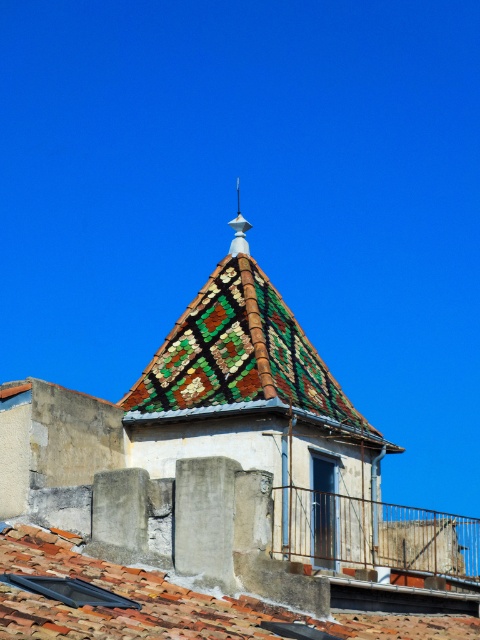
Question: Which object appears closest to the camera in this image?

Choices:
 (A) white glossy spire at upper center
 (B) terracotta clay tiles at lower left
 (C) mosaic tile roof at center

Answer: (B)

Question: Which point appears farthest from the camera in this image?

Choices:
 (A) (240, 232)
 (B) (181, 349)

Answer: (A)

Question: Is mosaic tile roof at center wider than terracotta clay tiles at lower left?

Choices:
 (A) no
 (B) yes

Answer: (A)

Question: Considering the relative positions of terracotta clay tiles at lower left and white glossy spire at upper center in the image provided, where is terracotta clay tiles at lower left located with respect to white glossy spire at upper center?

Choices:
 (A) right
 (B) left

Answer: (A)

Question: Is mosaic tile roof at center thinner than white glossy spire at upper center?

Choices:
 (A) yes
 (B) no

Answer: (B)

Question: Which point is farther to the camera?

Choices:
 (A) (455, 621)
 (B) (230, 241)

Answer: (B)